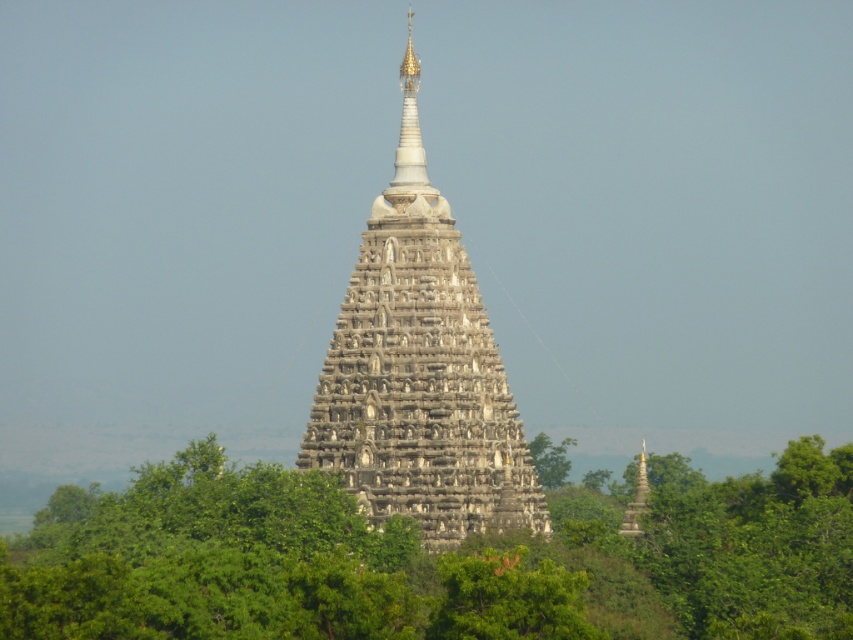
You are standing in front of the gray stone pagoda at center and want to see the green leafy trees at center. In which direction should you look relative to the pagoda?

The green leafy trees at center are located below the gray stone pagoda at center, so you should look downward to see them.